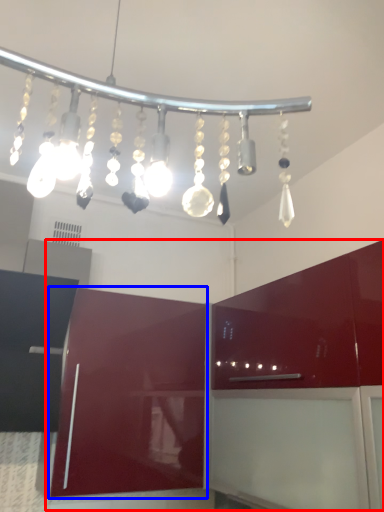
Question: Which object appears farthest to the camera in this image, cabinetry (highlighted by a red box) or cabinetry (highlighted by a blue box)?

Choices:
 (A) cabinetry
 (B) cabinetry

Answer: (B)